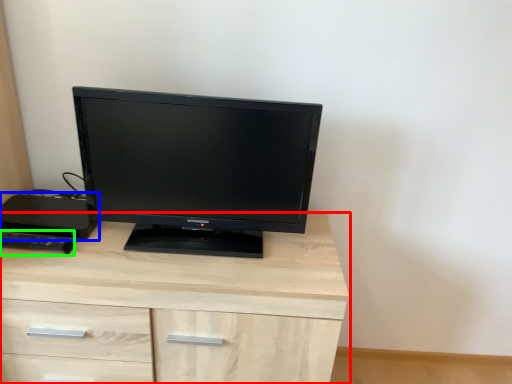
Question: Considering the real-world distances, which object is farthest from chest of drawers (highlighted by a red box)? desktop (highlighted by a blue box) or desktop (highlighted by a green box)?

Choices:
 (A) desktop
 (B) desktop

Answer: (B)